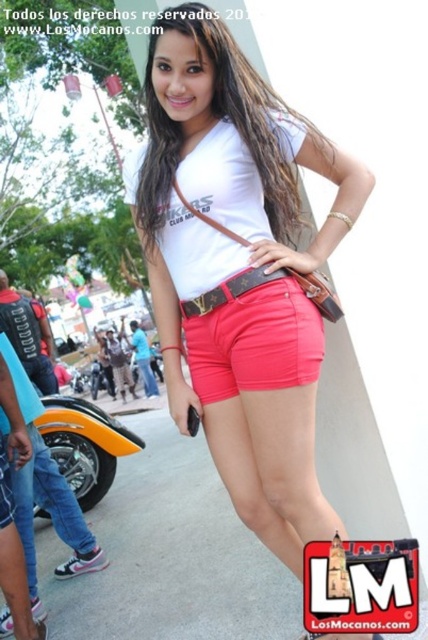
Question: Can you confirm if pink cotton shorts at lower center is positioned above brown leather belt at center?

Choices:
 (A) yes
 (B) no

Answer: (B)

Question: Is the position of matte white hair at center more distant than that of pink cotton shorts at lower center?

Choices:
 (A) yes
 (B) no

Answer: (B)

Question: Which of these objects is positioned farthest from the matte white hair at center?

Choices:
 (A) brown leather belt at center
 (B) matte pink shorts at center
 (C) pink cotton shorts at lower center

Answer: (C)

Question: Which object is positioned farthest from the pink cotton shorts at lower center?

Choices:
 (A) orange matte motorcycle at lower left
 (B) brown leather belt at center
 (C) matte white hair at center

Answer: (C)

Question: Which point is closer to the camera?

Choices:
 (A) pink cotton shorts at lower center
 (B) brown leather belt at center
 (C) matte pink shorts at center
 (D) orange matte motorcycle at lower left

Answer: (C)

Question: Does matte pink shorts at center have a smaller size compared to brown leather belt at center?

Choices:
 (A) yes
 (B) no

Answer: (B)